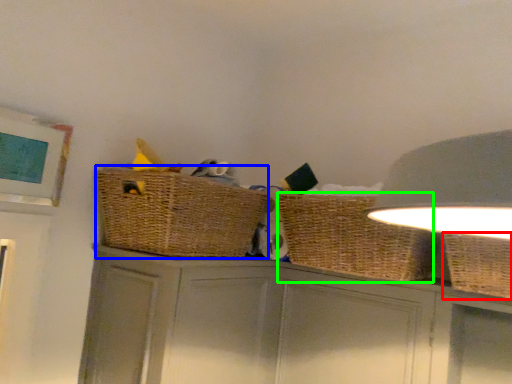
Question: Which object is positioned closest to basket (highlighted by a red box)? Select from basket container (highlighted by a blue box) and basket (highlighted by a green box).

Choices:
 (A) basket container
 (B) basket

Answer: (B)